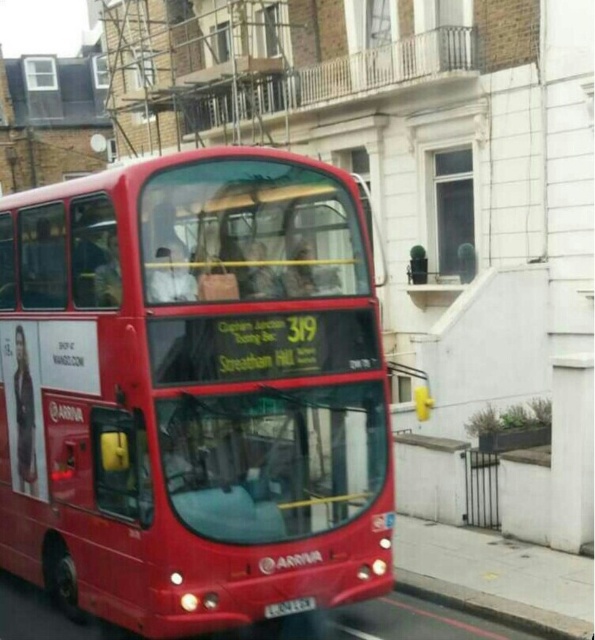
Question: Which of the following is the farthest from the observer?

Choices:
 (A) black plastic license plate at center
 (B) gray concrete curb at lower right
 (C) shiny red bus at center

Answer: (B)

Question: Estimate the real-world distances between objects in this image. Which object is closer to the shiny red bus at center?

Choices:
 (A) black plastic license plate at center
 (B) gray concrete curb at lower right

Answer: (A)

Question: Is gray concrete curb at lower right behind black plastic license plate at center?

Choices:
 (A) yes
 (B) no

Answer: (A)

Question: Can you confirm if shiny red bus at center is positioned above black plastic license plate at center?

Choices:
 (A) no
 (B) yes

Answer: (B)

Question: Does gray concrete curb at lower right have a greater width compared to black plastic license plate at center?

Choices:
 (A) no
 (B) yes

Answer: (B)

Question: Which point is farther from the camera taking this photo?

Choices:
 (A) (568, 634)
 (B) (273, 616)

Answer: (A)